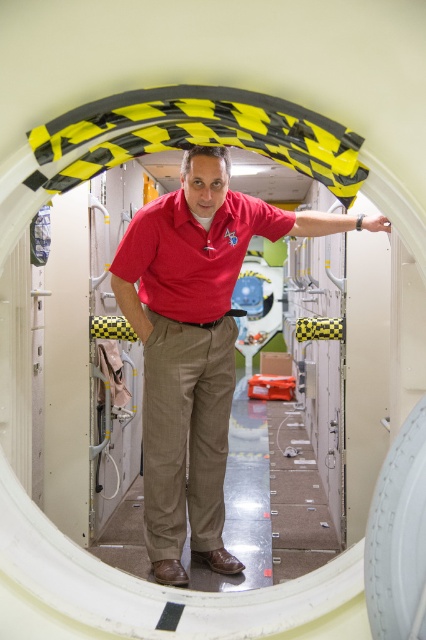
Question: Does matte red shirt at center appear on the right side of khaki fabric trousers at center?

Choices:
 (A) yes
 (B) no

Answer: (A)

Question: Which object appears closest to the camera in this image?

Choices:
 (A) matte red polo shirt at center
 (B) matte red shirt at center

Answer: (B)

Question: Considering the real-world distances, which object is closest to the khaki fabric trousers at center?

Choices:
 (A) matte red polo shirt at center
 (B) matte red shirt at center

Answer: (B)

Question: Can you confirm if khaki fabric trousers at center is wider than matte red polo shirt at center?

Choices:
 (A) yes
 (B) no

Answer: (B)

Question: Which object is the farthest from the khaki fabric trousers at center?

Choices:
 (A) matte red polo shirt at center
 (B) matte red shirt at center

Answer: (A)

Question: In this image, where is matte red shirt at center located relative to matte red polo shirt at center?

Choices:
 (A) right
 (B) left

Answer: (A)